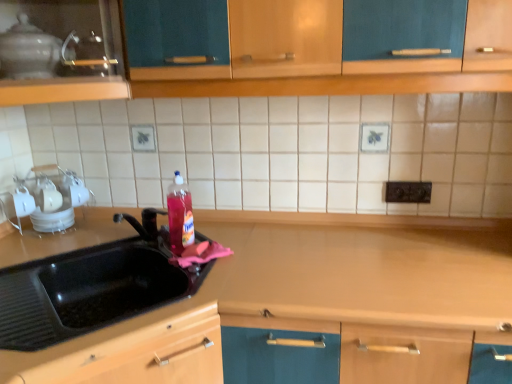
Question: Can you confirm if white glossy dish rack at left, the second appliance positioned from the top, is shorter than translucent plastic bottle at sink?

Choices:
 (A) yes
 (B) no

Answer: (A)

Question: Does white glossy dish rack at left, the first appliance from the bottom, have a larger size compared to translucent plastic bottle at sink?

Choices:
 (A) yes
 (B) no

Answer: (B)

Question: Does white glossy dish rack at left, the 1th appliance from the back, lie behind translucent plastic bottle at sink?

Choices:
 (A) yes
 (B) no

Answer: (A)

Question: From a real-world perspective, is white glossy dish rack at left, the 1th appliance from the back, physically below translucent plastic bottle at sink?

Choices:
 (A) no
 (B) yes

Answer: (B)

Question: Is translucent plastic bottle at sink located within white glossy dish rack at left, the first appliance from the bottom?

Choices:
 (A) no
 (B) yes

Answer: (A)

Question: From the image's perspective, is white glossy dish rack at left, the first appliance from the bottom, on translucent plastic bottle at sink?

Choices:
 (A) yes
 (B) no

Answer: (B)

Question: Is translucent plastic bottle at sink smaller than black plastic electric outlet at upper center?

Choices:
 (A) no
 (B) yes

Answer: (A)

Question: Is translucent plastic bottle at sink surrounding black plastic electric outlet at upper center?

Choices:
 (A) no
 (B) yes

Answer: (A)

Question: Would you say translucent plastic bottle at sink is a long distance from black plastic electric outlet at upper center?

Choices:
 (A) no
 (B) yes

Answer: (A)

Question: Does translucent plastic bottle at sink turn towards black plastic electric outlet at upper center?

Choices:
 (A) no
 (B) yes

Answer: (A)

Question: Can you confirm if translucent plastic bottle at sink is thinner than black plastic electric outlet at upper center?

Choices:
 (A) yes
 (B) no

Answer: (B)

Question: From a real-world perspective, is translucent plastic bottle at sink beneath black plastic electric outlet at upper center?

Choices:
 (A) yes
 (B) no

Answer: (A)

Question: Can you confirm if matte wood cabinet at upper left is wider than black plastic electric outlet at upper center?

Choices:
 (A) no
 (B) yes

Answer: (B)